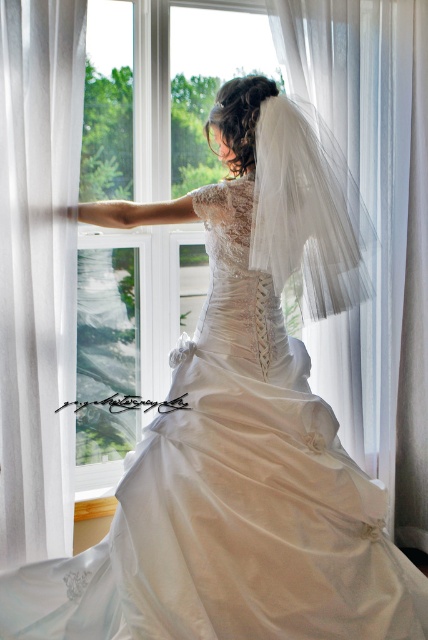
Question: Does white sheer curtain at left come behind white tulle veil at center?

Choices:
 (A) no
 (B) yes

Answer: (B)

Question: Does white sheer curtain at left appear over white tulle veil at center?

Choices:
 (A) yes
 (B) no

Answer: (B)

Question: Which point is closer to the camera?

Choices:
 (A) (339, 189)
 (B) (8, 296)

Answer: (A)

Question: Can you confirm if white sheer curtain at left is positioned below white tulle veil at center?

Choices:
 (A) yes
 (B) no

Answer: (A)